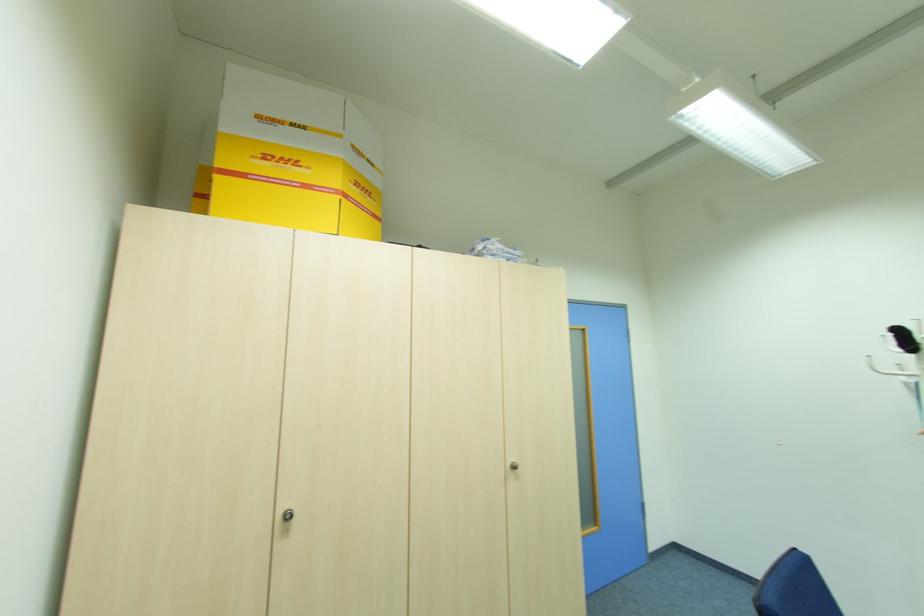
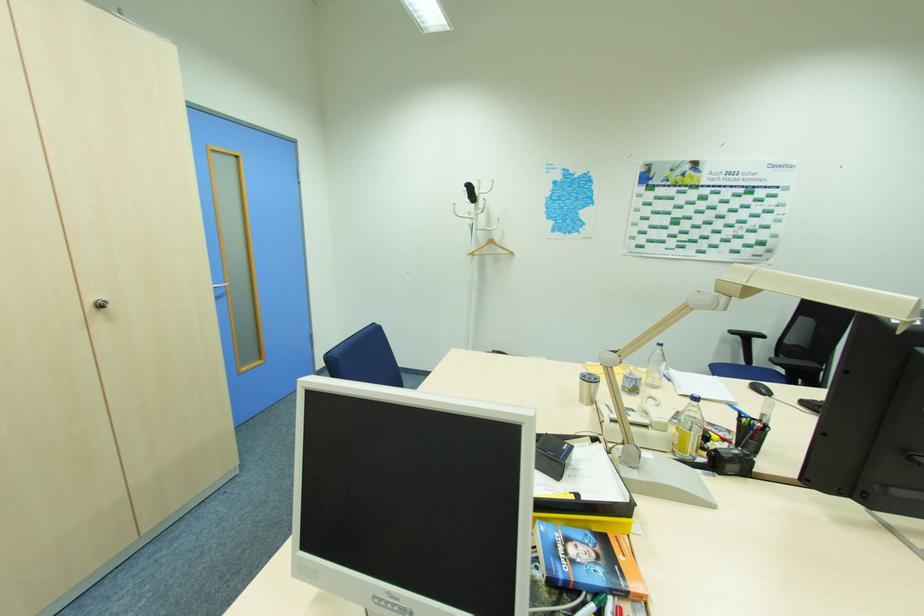
The point at [517,467] is marked in the first image. Where is the corresponding point in the second image?

(103, 306)